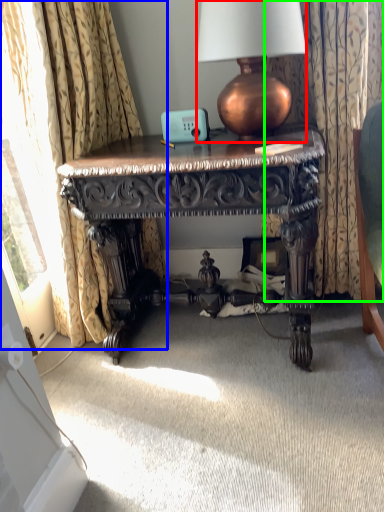
Question: Which object is positioned closest to lamp (highlighted by a red box)? Select from curtain (highlighted by a blue box) and curtain (highlighted by a green box).

Choices:
 (A) curtain
 (B) curtain

Answer: (B)